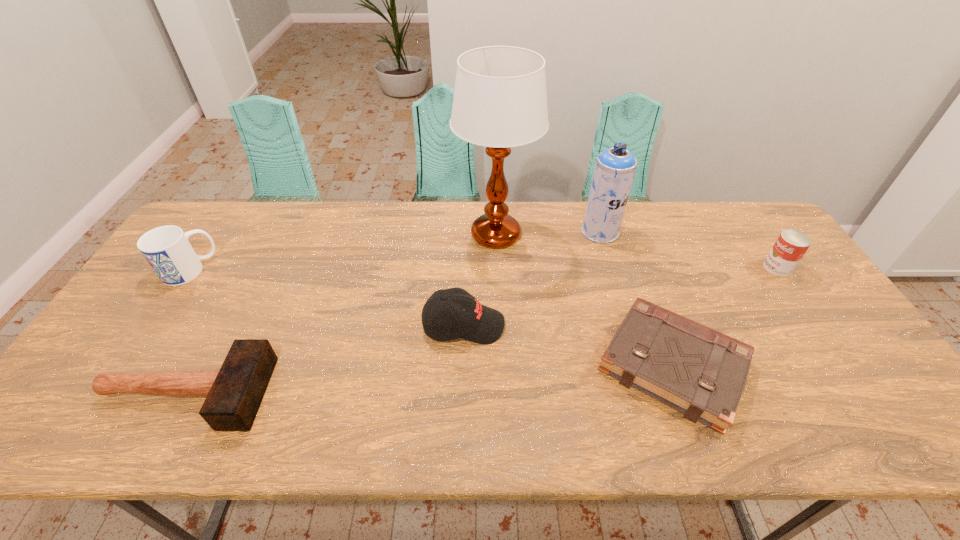
Locate an element on the screen. This screenshot has width=960, height=540. vacant space situated on the front label of the rightmost object is located at coordinates (721, 268).

What are the coordinates of `free spot located 0.160m on the front label of the rightmost object` in the screenshot? It's located at 711,268.

This screenshot has width=960, height=540. Find the location of `vacant space located 0.110m on the front label of the rightmost object`. vacant space located 0.110m on the front label of the rightmost object is located at coordinates (728, 268).

Where is `vacant space located on the front-facing side of the baseball cap`? This screenshot has height=540, width=960. vacant space located on the front-facing side of the baseball cap is located at coordinates (542, 325).

Locate an element on the screen. The width and height of the screenshot is (960, 540). vacant point located 0.160m on the hammer head face of the mallet is located at coordinates (334, 393).

This screenshot has width=960, height=540. I want to click on free location located on the right of the hardback book, so click(851, 366).

The height and width of the screenshot is (540, 960). Find the location of `table lamp that is at the far edge`. table lamp that is at the far edge is located at coordinates (500, 101).

You are a GUI agent. You are given a task and a screenshot of the screen. Output one action in this format:
    pyautogui.click(x=<x>, y=<y>)
    Task: Click on the aerosol can at the far edge
    This screenshot has height=540, width=960.
    Given the screenshot: What is the action you would take?
    pyautogui.click(x=614, y=170)

At what (x,y) coordinates should I click in order to perform the action: click on mallet at the near edge. Please return your answer as a coordinate pair (x, y). Looking at the image, I should click on (234, 393).

Where is `hardback book present at the near edge`? The image size is (960, 540). hardback book present at the near edge is located at coordinates (694, 369).